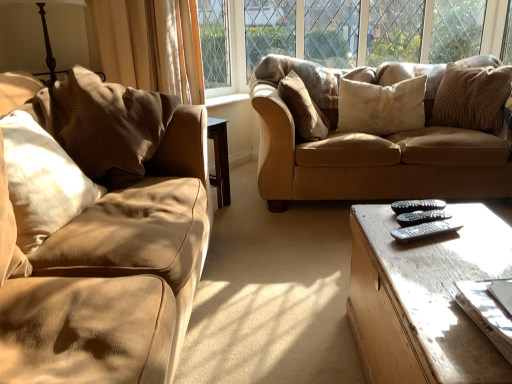
Identify the location of black plastic remote at center, the 2th remote when ordered from front to back. This screenshot has height=384, width=512. (421, 217).

Locate an element on the screen. This screenshot has height=384, width=512. brown corduroy pillow at center, which is the third pillow from left to right is located at coordinates (303, 109).

What is the approximate width of black plastic remote at center, positioned as the third remote in front-to-back order?

7.59 inches.

Find the location of `brown corduroy pillow at upper right, positioned as the fifth pillow in left-to-right order`. brown corduroy pillow at upper right, positioned as the fifth pillow in left-to-right order is located at coordinates (472, 97).

The width and height of the screenshot is (512, 384). I want to click on white corduroy pillow at upper right, arranged as the fourth pillow when viewed from the left, so click(x=381, y=106).

Are black plastic remote at center, positioned as the third remote in front-to-back order, and brown corduroy pillow at upper right, positioned as the fifth pillow in left-to-right order, located far from each other?

Yes, black plastic remote at center, positioned as the third remote in front-to-back order, and brown corduroy pillow at upper right, positioned as the fifth pillow in left-to-right order, are located far from each other.

Consider the image. Which of these two, black plastic remote at center, positioned as the third remote in front-to-back order, or brown corduroy pillow at upper right, marked as the 1th pillow in a right-to-left arrangement, is wider?

Wider between the two is brown corduroy pillow at upper right, marked as the 1th pillow in a right-to-left arrangement.

From a real-world perspective, is black plastic remote at center, positioned as the third remote in front-to-back order, on top of brown corduroy pillow at upper right, positioned as the fifth pillow in left-to-right order?

Incorrect, from a real-world perspective, black plastic remote at center, positioned as the third remote in front-to-back order, is lower than brown corduroy pillow at upper right, positioned as the fifth pillow in left-to-right order.

Considering the relative positions of brown corduroy pillow at upper right, positioned as the fifth pillow in left-to-right order, and light brown wooden coffee table at lower right in the image provided, is brown corduroy pillow at upper right, positioned as the fifth pillow in left-to-right order, behind light brown wooden coffee table at lower right?

Yes, brown corduroy pillow at upper right, positioned as the fifth pillow in left-to-right order, is behind light brown wooden coffee table at lower right.

Does point (490, 108) lie behind point (490, 272)?

Yes, it is.

Considering the sizes of brown corduroy pillow at upper right, positioned as the fifth pillow in left-to-right order, and light brown wooden coffee table at lower right in the image, is brown corduroy pillow at upper right, positioned as the fifth pillow in left-to-right order, wider or thinner than light brown wooden coffee table at lower right?

Considering their sizes, brown corduroy pillow at upper right, positioned as the fifth pillow in left-to-right order, looks slimmer than light brown wooden coffee table at lower right.

Is brown corduroy pillow at upper right, positioned as the fifth pillow in left-to-right order, smaller than light brown wooden coffee table at lower right?

Yes.

Is matte brown couch at center with brown corduroy pillow at center, which is the 3th pillow from right to left?

No, matte brown couch at center is not with brown corduroy pillow at center, which is the 3th pillow from right to left.

From the matte brown couch at center, count 1st pillows backward and point to it. Please provide its 2D coordinates.

[(303, 109)]

From a real-world perspective, does matte brown couch at center stand above brown corduroy pillow at center, which is the third pillow from left to right?

No, from a real-world perspective, matte brown couch at center is not above brown corduroy pillow at center, which is the third pillow from left to right.

Is brown corduroy pillow at center, which is the third pillow from left to right, in front of or behind white corduroy pillow at upper right, the second pillow positioned from the right, in the image?

brown corduroy pillow at center, which is the third pillow from left to right, is positioned closer to the viewer than white corduroy pillow at upper right, the second pillow positioned from the right.

From the image's perspective, is brown corduroy pillow at center, which is the third pillow from left to right, positioned above or below white corduroy pillow at upper right, the second pillow positioned from the right?

Based on their image positions, brown corduroy pillow at center, which is the third pillow from left to right, is located beneath white corduroy pillow at upper right, the second pillow positioned from the right.

This screenshot has height=384, width=512. Identify the location of the 2nd pillow in front when counting from the white corduroy pillow at upper right, arranged as the fourth pillow when viewed from the left. (303, 109).

From the image's perspective, who appears lower, brown corduroy pillow at left, placed as the 2th pillow when sorted from left to right, or matte brown couch at center?

From the image's view, brown corduroy pillow at left, placed as the 2th pillow when sorted from left to right, is below.

Does brown corduroy pillow at left, the fourth pillow in the right-to-left sequence, touch matte brown couch at center?

No.

Between brown corduroy pillow at left, the fourth pillow in the right-to-left sequence, and matte brown couch at center, which one is positioned behind?

Positioned behind is matte brown couch at center.

Is brown corduroy pillow at left, placed as the 2th pillow when sorted from left to right, inside or outside of matte brown couch at center?

brown corduroy pillow at left, placed as the 2th pillow when sorted from left to right, exists outside the volume of matte brown couch at center.

Does brown corduroy pillow at center, which is the 3th pillow from right to left, have a lesser height compared to light brown wooden coffee table at lower right?

No.

Does brown corduroy pillow at center, which is the third pillow from left to right, lie behind light brown wooden coffee table at lower right?

Yes.

Would you say brown corduroy pillow at center, which is the third pillow from left to right, is to the left or to the right of light brown wooden coffee table at lower right in the picture?

In the image, brown corduroy pillow at center, which is the third pillow from left to right, appears on the left side of light brown wooden coffee table at lower right.

Does brown corduroy pillow at center, which is the 3th pillow from right to left, turn towards light brown wooden coffee table at lower right?

No, brown corduroy pillow at center, which is the 3th pillow from right to left, is not oriented towards light brown wooden coffee table at lower right.

Considering their positions, is brown corduroy pillow at upper right, marked as the 1th pillow in a right-to-left arrangement, located in front of or behind brown corduroy pillow at left, placed as the 2th pillow when sorted from left to right?

brown corduroy pillow at upper right, marked as the 1th pillow in a right-to-left arrangement, is positioned farther from the viewer than brown corduroy pillow at left, placed as the 2th pillow when sorted from left to right.

Is brown corduroy pillow at upper right, marked as the 1th pillow in a right-to-left arrangement, situated inside brown corduroy pillow at left, the fourth pillow in the right-to-left sequence, or outside?

The correct answer is: outside.

Which of these two, brown corduroy pillow at upper right, marked as the 1th pillow in a right-to-left arrangement, or brown corduroy pillow at left, placed as the 2th pillow when sorted from left to right, is smaller?

With smaller size is brown corduroy pillow at upper right, marked as the 1th pillow in a right-to-left arrangement.

Is brown corduroy pillow at upper right, marked as the 1th pillow in a right-to-left arrangement, beside brown corduroy pillow at left, placed as the 2th pillow when sorted from left to right?

brown corduroy pillow at upper right, marked as the 1th pillow in a right-to-left arrangement, and brown corduroy pillow at left, placed as the 2th pillow when sorted from left to right, are clearly separated.

Where is `remote that is the 1st object located below the brown corduroy pillow at upper right, marked as the 1th pillow in a right-to-left arrangement (from the image's perspective)`? remote that is the 1st object located below the brown corduroy pillow at upper right, marked as the 1th pillow in a right-to-left arrangement (from the image's perspective) is located at coordinates (417, 205).

Image resolution: width=512 pixels, height=384 pixels. In order to click on pillow that is the 5th one when counting upward from the light brown wooden coffee table at lower right (from the image's perspective) in this screenshot , I will do `click(472, 97)`.

Considering their positions, is black plastic remote at center, arranged as the first remote when viewed from the back, positioned further to black plastic remote at center, which is the first remote in front-to-back order, than brown corduroy pillow at upper right, positioned as the fifth pillow in left-to-right order?

The object further to black plastic remote at center, which is the first remote in front-to-back order, is brown corduroy pillow at upper right, positioned as the fifth pillow in left-to-right order.

Looking at this image, from the image, which object appears to be nearer to brown corduroy pillow at upper right, positioned as the fifth pillow in left-to-right order, brown corduroy pillow at left, placed as the 2th pillow when sorted from left to right, or white corduroy pillow at left, which is counted as the 5th pillow, starting from the right?

brown corduroy pillow at left, placed as the 2th pillow when sorted from left to right.

Based on their spatial positions, is white corduroy pillow at left, which is the 1th pillow in left-to-right order, or beige corduroy curtain at upper left closer to brown corduroy pillow at upper right, positioned as the fifth pillow in left-to-right order?

The object closer to brown corduroy pillow at upper right, positioned as the fifth pillow in left-to-right order, is beige corduroy curtain at upper left.

From the image, which object appears to be nearer to matte brown couch at center, light brown wooden coffee table at lower right or beige corduroy curtain at upper left?

beige corduroy curtain at upper left is closer to matte brown couch at center.

Estimate the real-world distances between objects in this image. Which object is further from black plastic remote at center, which is the first remote in front-to-back order, matte brown couch at center or brown corduroy pillow at center, which is the 3th pillow from right to left?

matte brown couch at center is further to black plastic remote at center, which is the first remote in front-to-back order.

Based on their spatial positions, is brown corduroy pillow at upper right, positioned as the fifth pillow in left-to-right order, or matte brown couch at center closer to white corduroy pillow at left, which is the 1th pillow in left-to-right order?

matte brown couch at center is closer to white corduroy pillow at left, which is the 1th pillow in left-to-right order.

From the image, which object appears to be nearer to black plastic remote at center, which ranks as the 2th remote in back-to-front order, beige corduroy curtain at upper left or brown corduroy pillow at center, which is the third pillow from left to right?

Among the two, brown corduroy pillow at center, which is the third pillow from left to right, is located nearer to black plastic remote at center, which ranks as the 2th remote in back-to-front order.

Looking at the image, which one is located closer to white corduroy pillow at left, which is the 1th pillow in left-to-right order, brown corduroy pillow at left, the fourth pillow in the right-to-left sequence, or black plastic remote at center, positioned as the third remote in front-to-back order?

The object closer to white corduroy pillow at left, which is the 1th pillow in left-to-right order, is brown corduroy pillow at left, the fourth pillow in the right-to-left sequence.

The width and height of the screenshot is (512, 384). Find the location of `studio couch between beige corduroy curtain at upper left and brown corduroy pillow at upper right, positioned as the fifth pillow in left-to-right order`. studio couch between beige corduroy curtain at upper left and brown corduroy pillow at upper right, positioned as the fifth pillow in left-to-right order is located at coordinates (369, 145).

The image size is (512, 384). What are the coordinates of `coffee table between brown corduroy pillow at left, placed as the 2th pillow when sorted from left to right, and brown corduroy pillow at upper right, positioned as the fifth pillow in left-to-right order, from left to right` in the screenshot? It's located at (424, 298).

Identify the location of curtain positioned between light brown wooden coffee table at lower right and brown corduroy pillow at center, which is the third pillow from left to right, from near to far. pos(147,45).

At what (x,y) coordinates should I click in order to perform the action: click on remote between black plastic remote at center, the 2th remote when ordered from front to back, and brown corduroy pillow at center, which is the 3th pillow from right to left, along the z-axis. Please return your answer as a coordinate pair (x, y). The width and height of the screenshot is (512, 384). Looking at the image, I should click on (417, 205).